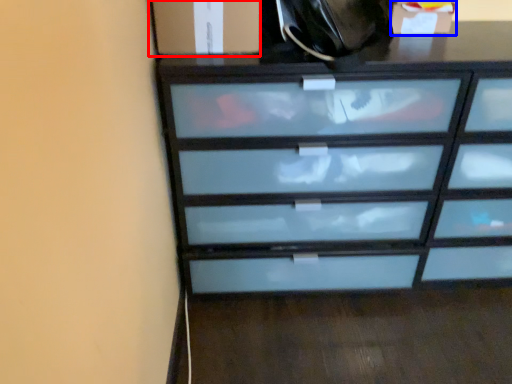
Question: Which object appears farthest to the camera in this image, cabinetry (highlighted by a red box) or cabinetry (highlighted by a blue box)?

Choices:
 (A) cabinetry
 (B) cabinetry

Answer: (B)